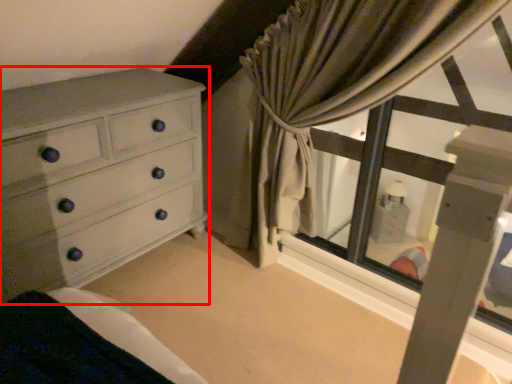
Question: From the image's perspective, considering the relative positions of chest of drawers (annotated by the red box) and curtain in the image provided, where is chest of drawers (annotated by the red box) located with respect to the staircase?

Choices:
 (A) above
 (B) below

Answer: (B)